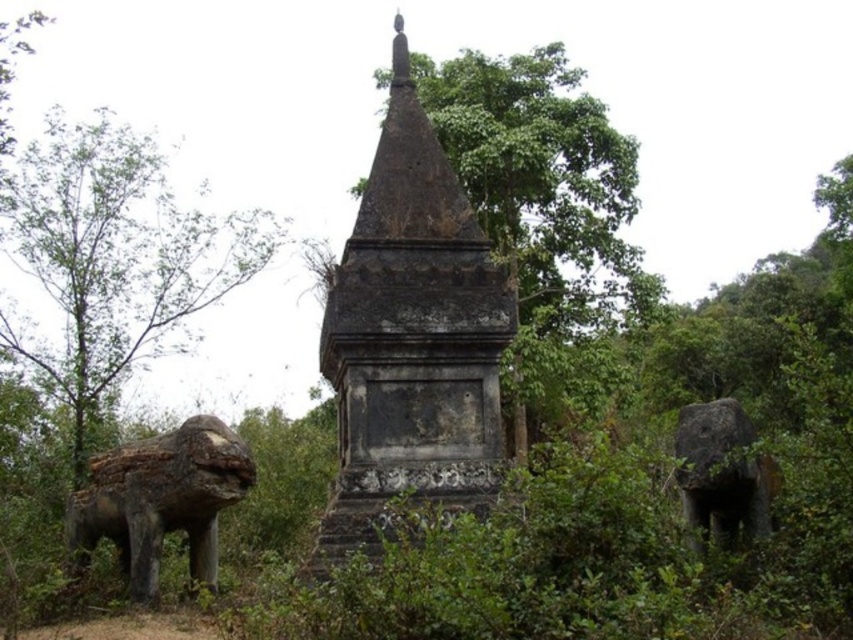
You are a visitor standing in front of the dark gray stone stupa at center and the green leafy tree at left. Which object is positioned higher in the scene?

The dark gray stone stupa at center is located below the green leafy tree at left, so the green leafy tree at left is positioned higher in the scene.

From the picture: You are a visitor standing at the entrance of the monument complex. You see the dark gray stone stupa at center and the green leafy tree at left. Which one appears taller from your viewpoint?

The green leafy tree at left is taller than the dark gray stone stupa at center.

You are a visitor standing at the entrance of the monument complex. You see the dark gray stone stupa at center and the green leafy tree at center. Which object is closer to your left side?

The dark gray stone stupa at center is positioned on the left side of green leafy tree at center, so from your perspective at the entrance, the dark gray stone stupa at center would be closer to your left side.